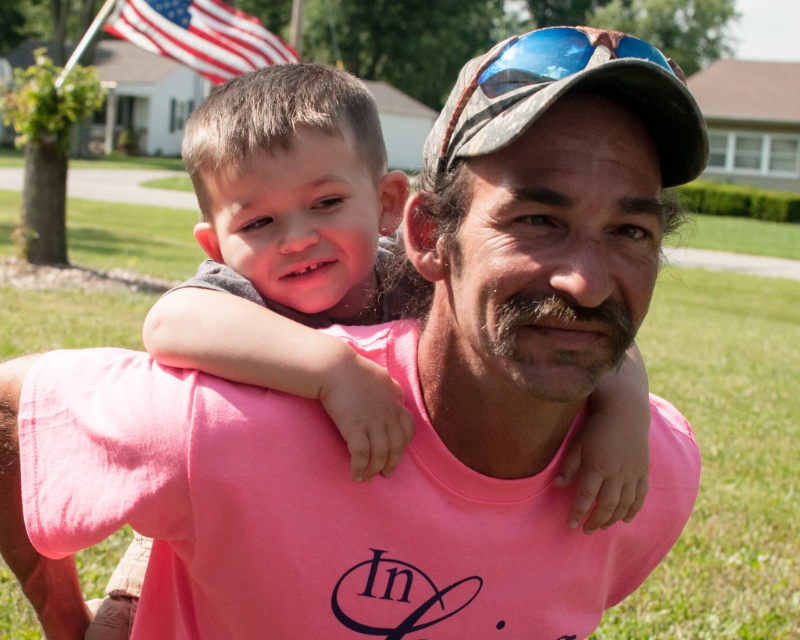
You are a photographer setting up for a family photo. You see the american flag at upper left and the blue reflective lens at center. Which object should you avoid pointing your camera directly at to prevent glare?

The blue reflective lens at center should be avoided because it is a reflective surface and could cause glare, whereas the american flag at upper left is not described as reflective.

You are a photographer trying to capture the perfect shot of the camouflage fabric baseball cap at upper center and the blue reflective lens at center. Which object should you zoom in on to ensure it fills the frame more effectively?

The camouflage fabric baseball cap at upper center is bigger than the blue reflective lens at center, so you should zoom in on the blue reflective lens at center to make it larger in the frame.